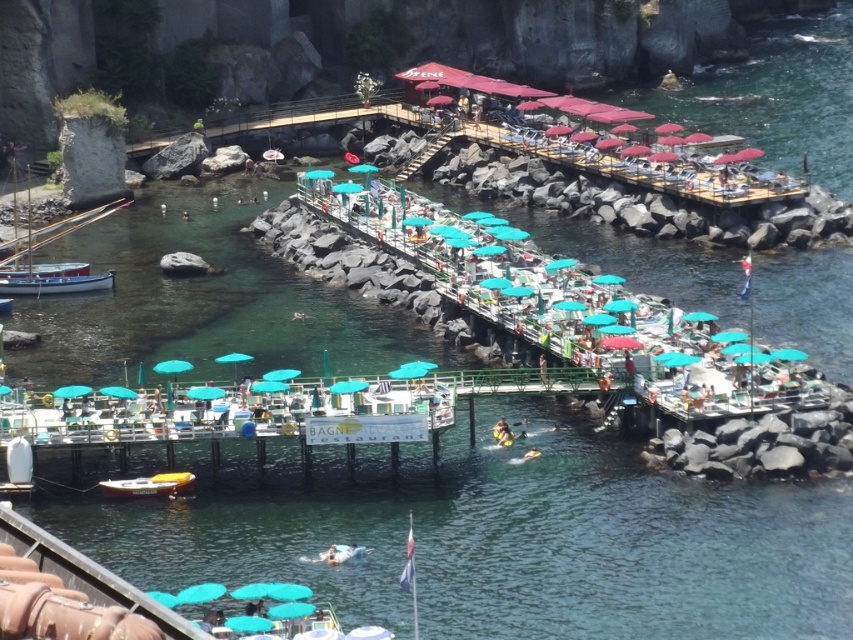
Question: Which object is farther from the camera taking this photo?

Choices:
 (A) white wooden boat at left
 (B) green plastic umbrellas at center
 (C) teal fabric umbrella at center
 (D) yellow-orange plastic kayak at lower left

Answer: (A)

Question: Is green plastic umbrellas at center thinner than yellow-orange plastic kayak at lower left?

Choices:
 (A) no
 (B) yes

Answer: (A)

Question: Which object appears farthest from the camera in this image?

Choices:
 (A) white wooden boat at left
 (B) green plastic umbrellas at center
 (C) teal fabric umbrella at center
 (D) yellow-orange plastic kayak at lower left

Answer: (A)

Question: Which point is closer to the camera?

Choices:
 (A) (74, 224)
 (B) (206, 244)
 (C) (187, 483)

Answer: (C)

Question: Does white wooden boat at left appear over yellow-orange plastic kayak at lower left?

Choices:
 (A) yes
 (B) no

Answer: (A)

Question: Is green plastic umbrellas at center below yellow-orange plastic kayak at lower left?

Choices:
 (A) no
 (B) yes

Answer: (A)